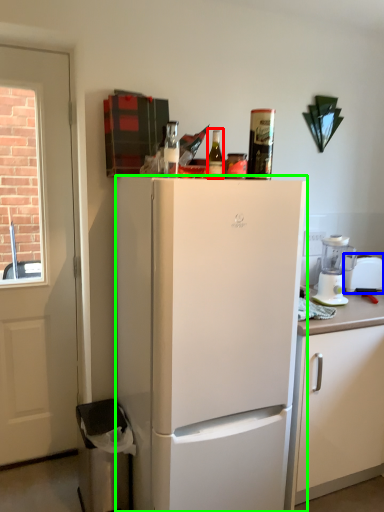
Question: Based on their relative distances, which object is farther from bottle (highlighted by a red box)? Choose from appliance (highlighted by a blue box) and refrigerator (highlighted by a green box).

Choices:
 (A) appliance
 (B) refrigerator

Answer: (A)